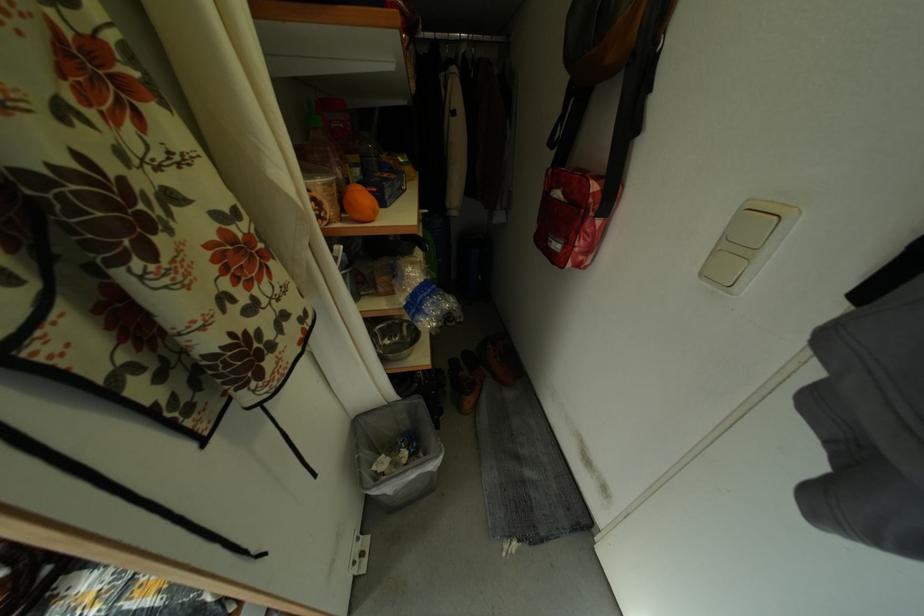
Which object does [569,217] point to?

This point indicates the red shoulder bag.